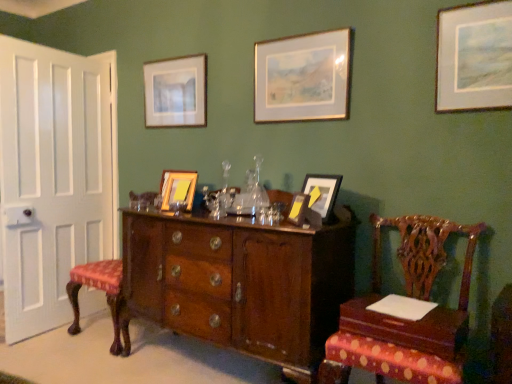
Locate an element on the screen. This screenshot has height=384, width=512. vacant area on top of wooden table at lower right (from a real-world perspective) is located at coordinates (400, 307).